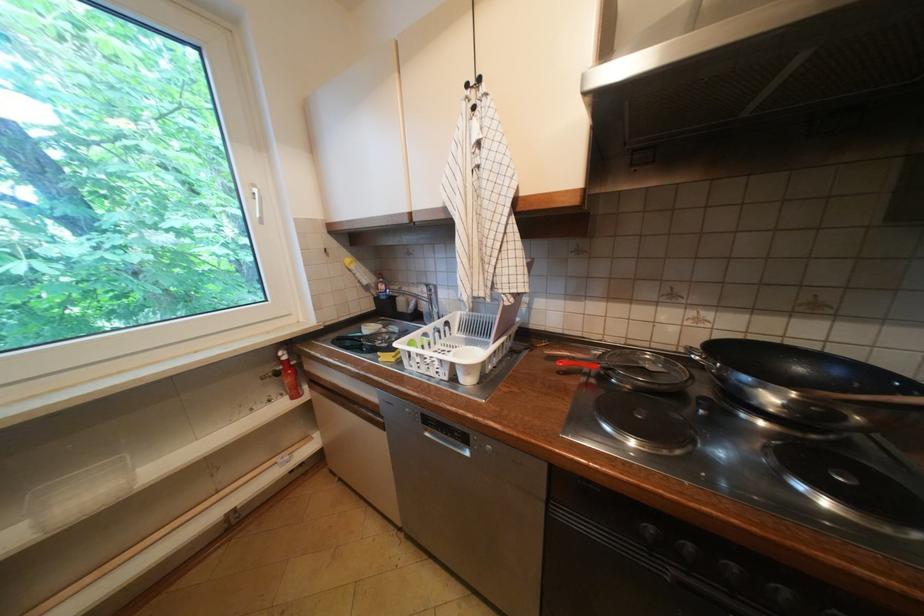
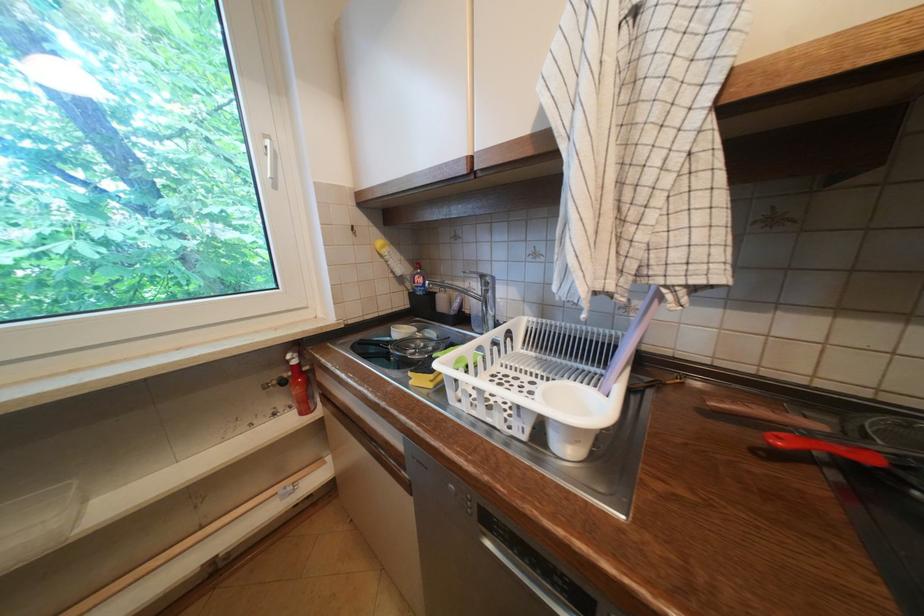
Where in the second image is the point corresponding to [424,297] from the first image?

(473, 293)